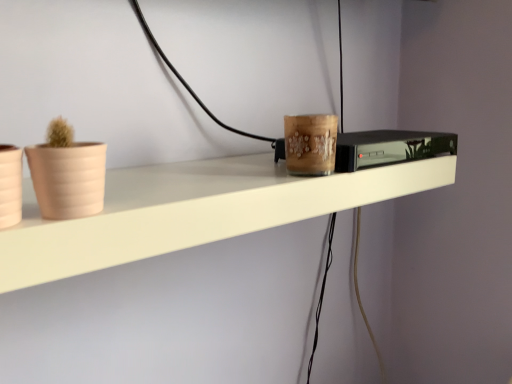
Question: Can you confirm if matte beige flowerpot at left, which is the 2th flowerpot in right-to-left order, is taller than black glossy tv at center?

Choices:
 (A) no
 (B) yes

Answer: (B)

Question: Is matte beige flowerpot at left, positioned as the 1th flowerpot in left-to-right order, beside black glossy tv at center?

Choices:
 (A) no
 (B) yes

Answer: (A)

Question: Is the depth of matte beige flowerpot at left, which is the 2th flowerpot in right-to-left order, greater than that of black glossy tv at center?

Choices:
 (A) no
 (B) yes

Answer: (A)

Question: Is matte beige flowerpot at left, positioned as the 1th flowerpot in left-to-right order, facing away from black glossy tv at center?

Choices:
 (A) no
 (B) yes

Answer: (A)

Question: Would you consider matte beige flowerpot at left, which is the 2th flowerpot in right-to-left order, to be distant from black glossy tv at center?

Choices:
 (A) yes
 (B) no

Answer: (B)

Question: Considering the relative sizes of matte beige flowerpot at left, which is the 2th flowerpot in right-to-left order, and black glossy tv at center in the image provided, is matte beige flowerpot at left, which is the 2th flowerpot in right-to-left order, bigger than black glossy tv at center?

Choices:
 (A) yes
 (B) no

Answer: (B)

Question: Can you confirm if beige matte flowerpot at left, which ranks as the second flowerpot in left-to-right order, is thinner than black glossy tv at center?

Choices:
 (A) yes
 (B) no

Answer: (A)

Question: Is beige matte flowerpot at left, the first flowerpot when ordered from right to left, further to camera compared to black glossy tv at center?

Choices:
 (A) no
 (B) yes

Answer: (A)

Question: Is beige matte flowerpot at left, the first flowerpot when ordered from right to left, surrounding black glossy tv at center?

Choices:
 (A) yes
 (B) no

Answer: (B)

Question: Does beige matte flowerpot at left, the first flowerpot when ordered from right to left, appear on the right side of black glossy tv at center?

Choices:
 (A) no
 (B) yes

Answer: (A)

Question: Does beige matte flowerpot at left, the first flowerpot when ordered from right to left, have a smaller size compared to black glossy tv at center?

Choices:
 (A) no
 (B) yes

Answer: (B)

Question: Can you confirm if beige matte flowerpot at left, the first flowerpot when ordered from right to left, is positioned to the left of black glossy tv at center?

Choices:
 (A) no
 (B) yes

Answer: (B)

Question: From the image's perspective, is black glossy tv at center located above matte beige flowerpot at left, positioned as the 1th flowerpot in left-to-right order?

Choices:
 (A) yes
 (B) no

Answer: (A)